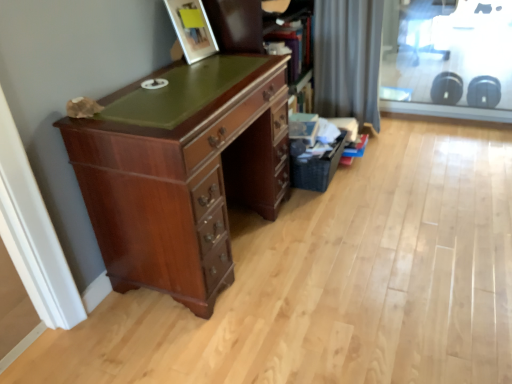
Question: From a real-world perspective, is black woven basket at lower right positioned over gray fabric curtain at upper right based on gravity?

Choices:
 (A) yes
 (B) no

Answer: (B)

Question: Is the position of black woven basket at lower right more distant than that of gray fabric curtain at upper right?

Choices:
 (A) no
 (B) yes

Answer: (A)

Question: Is black woven basket at lower right thinner than gray fabric curtain at upper right?

Choices:
 (A) yes
 (B) no

Answer: (A)

Question: Is black woven basket at lower right positioned with its back to gray fabric curtain at upper right?

Choices:
 (A) yes
 (B) no

Answer: (B)

Question: From the image's perspective, would you say black woven basket at lower right is positioned over gray fabric curtain at upper right?

Choices:
 (A) no
 (B) yes

Answer: (A)

Question: From their relative heights in the image, would you say mahogany wood desk at left is taller or shorter than gray fabric curtain at upper right?

Choices:
 (A) tall
 (B) short

Answer: (B)

Question: Visually, is mahogany wood desk at left positioned to the left or to the right of gray fabric curtain at upper right?

Choices:
 (A) left
 (B) right

Answer: (A)

Question: Do you think mahogany wood desk at left is within gray fabric curtain at upper right, or outside of it?

Choices:
 (A) outside
 (B) inside

Answer: (A)

Question: Does point (211, 215) appear closer or farther from the camera than point (376, 54)?

Choices:
 (A) closer
 (B) farther

Answer: (A)

Question: From the image's perspective, relative to black woven basket at lower right, is matte wood picture frame at upper center above or below?

Choices:
 (A) below
 (B) above

Answer: (B)

Question: Considering the relative positions of matte wood picture frame at upper center and black woven basket at lower right in the image provided, is matte wood picture frame at upper center to the left or to the right of black woven basket at lower right?

Choices:
 (A) right
 (B) left

Answer: (B)

Question: Is point (202, 39) closer or farther from the camera than point (302, 175)?

Choices:
 (A) farther
 (B) closer

Answer: (B)

Question: Considering the positions of matte wood picture frame at upper center and black woven basket at lower right in the image, is matte wood picture frame at upper center wider or thinner than black woven basket at lower right?

Choices:
 (A) thin
 (B) wide

Answer: (A)

Question: From the image's perspective, relative to wooden bookshelf at upper center, is gray fabric curtain at upper right above or below?

Choices:
 (A) below
 (B) above

Answer: (B)

Question: From a real-world perspective, is gray fabric curtain at upper right positioned above or below wooden bookshelf at upper center?

Choices:
 (A) below
 (B) above

Answer: (A)